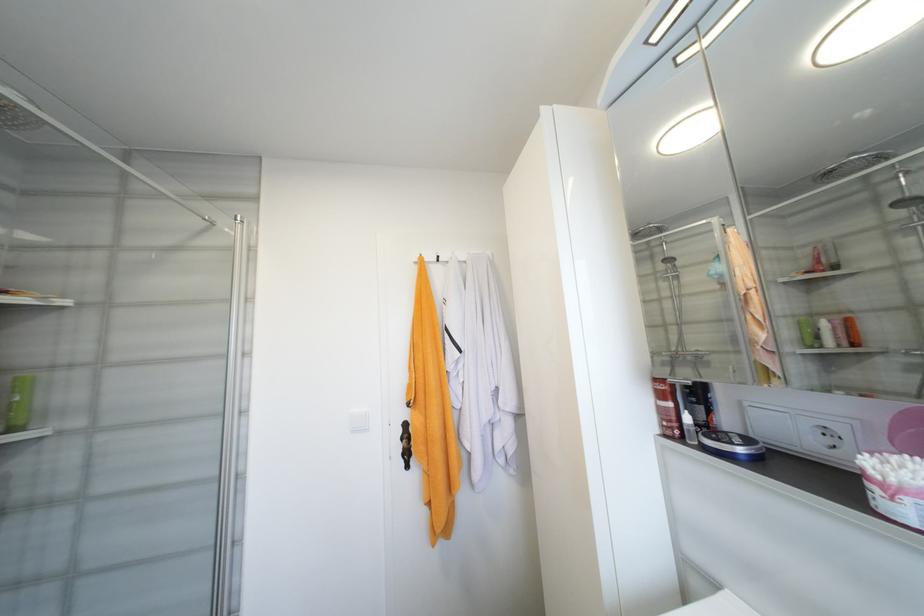
This screenshot has height=616, width=924. What do you see at coordinates (699, 405) in the screenshot?
I see `a black spray can` at bounding box center [699, 405].